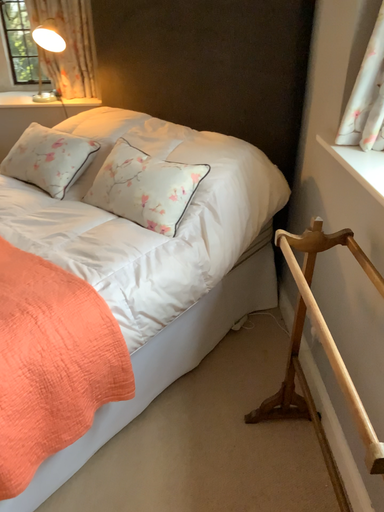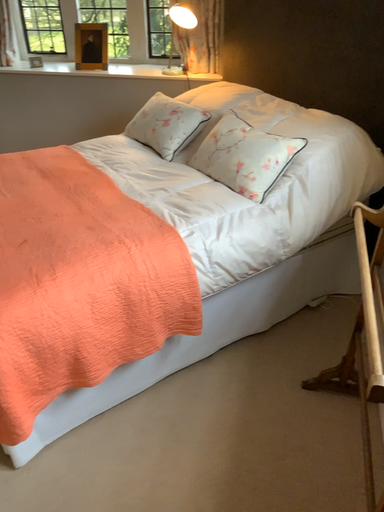
Question: How did the camera likely rotate when shooting the video?

Choices:
 (A) rotated right
 (B) rotated left

Answer: (B)